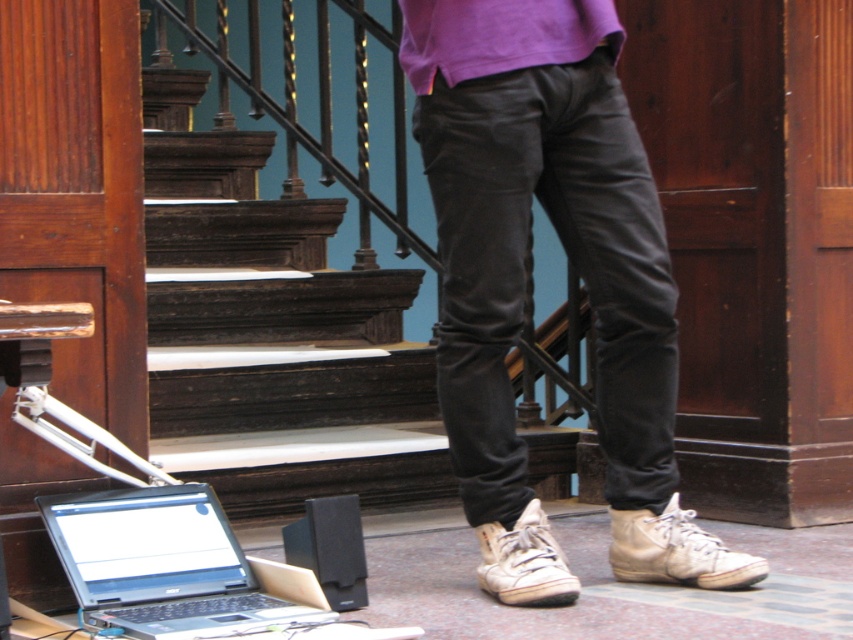
Can you confirm if matte black pants at center is bigger than silver metallic laptop at lower left?

Yes.

Describe the element at coordinates (529, 275) in the screenshot. I see `matte black pants at center` at that location.

Find the location of a particular element. This screenshot has width=853, height=640. matte black pants at center is located at coordinates (529, 275).

You are a GUI agent. You are given a task and a screenshot of the screen. Output one action in this format:
    pyautogui.click(x=<x>, y=<y>)
    Task: Click on the matte black pants at center
    Image resolution: width=853 pixels, height=640 pixels.
    Given the screenshot: What is the action you would take?
    pyautogui.click(x=529, y=275)

Is dark wood stairs at center positioned at the back of purple cotton sweatshirt at center?

Yes, it is.

Can you confirm if dark wood stairs at center is positioned below purple cotton sweatshirt at center?

Yes, dark wood stairs at center is below purple cotton sweatshirt at center.

Who is more distant from viewer, (146, 220) or (553, 12)?

The point (146, 220) is more distant.

This screenshot has width=853, height=640. What are the coordinates of `dark wood stairs at center` in the screenshot? It's located at (253, 256).

Does point (572, 116) come behind point (413, 16)?

Yes, point (572, 116) is behind point (413, 16).

Describe the element at coordinates (529, 275) in the screenshot. I see `matte black pants at center` at that location.

This screenshot has width=853, height=640. Find the location of `matte black pants at center`. matte black pants at center is located at coordinates (529, 275).